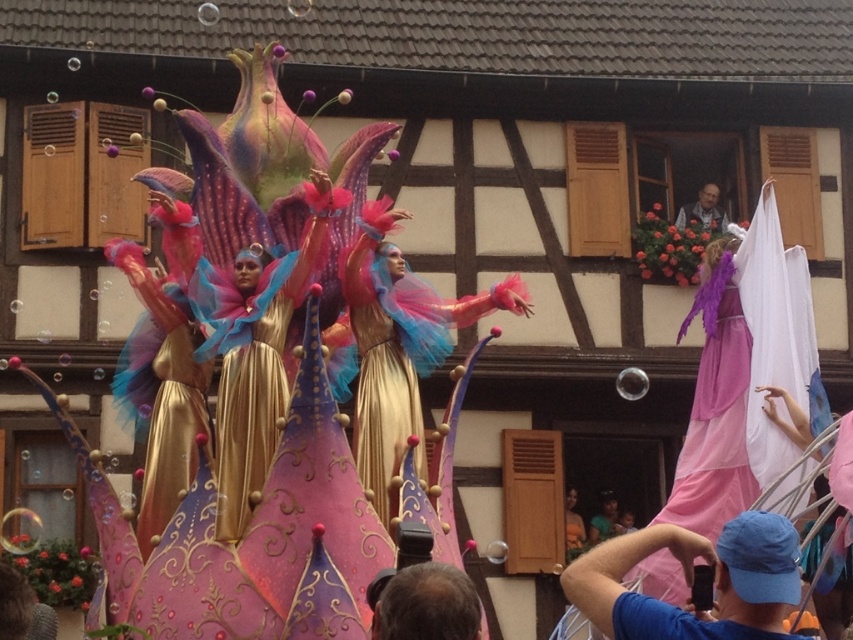
Question: Does gold metallic dress at center appear on the left side of orange fabric dress at lower center?

Choices:
 (A) no
 (B) yes

Answer: (B)

Question: Among these points, which one is nearest to the camera?

Choices:
 (A) (735, 600)
 (B) (613, 502)
 (C) (677, 224)
 (D) (476, 632)

Answer: (D)

Question: Estimate the real-world distances between objects in this image. Which object is closer to the shiny gold dress at center?

Choices:
 (A) pink satin dress at right
 (B) gray hair at upper center
 (C) blue fabric cap at lower right

Answer: (A)

Question: Is gold metallic dress at center bigger than smooth skin baby at lower center?

Choices:
 (A) no
 (B) yes

Answer: (B)

Question: Can you confirm if gold metallic dress at center is positioned above orange fabric dress at lower center?

Choices:
 (A) no
 (B) yes

Answer: (B)

Question: Which point is closer to the camera?

Choices:
 (A) (633, 596)
 (B) (463, 621)
 (C) (622, 616)
 (D) (575, 545)

Answer: (C)